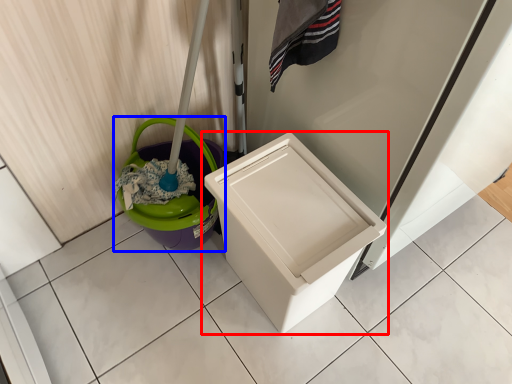
Question: Which object appears farthest to the camera in this image, waste container (highlighted by a red box) or potty (highlighted by a blue box)?

Choices:
 (A) waste container
 (B) potty

Answer: (B)